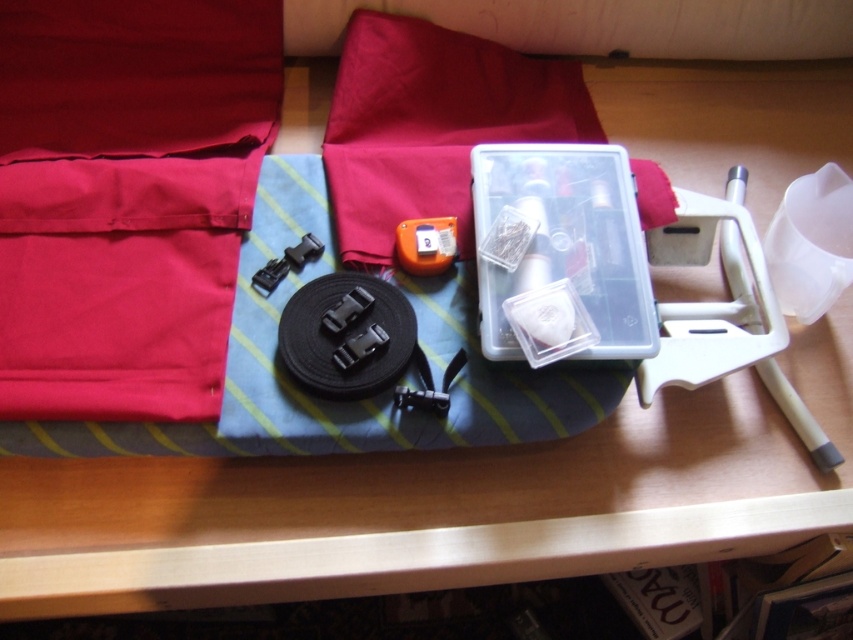
You have a limited space on your sewing table and need to place both the clear plastic container at center and the orange matte tape measure at center. Which object requires more horizontal space when placed side by side?

The clear plastic container at center requires more horizontal space when placed side by side with the orange matte tape measure at center because its width surpasses the tape measure.

You are organizing a sewing kit and need to place the white plastic stand at right and the orange matte tape measure at center into a drawer. Which one should you place first to ensure they both fit vertically?

The orange matte tape measure at center is shorter than the white plastic stand at right, so you should place the white plastic stand at right first to ensure both items fit vertically.